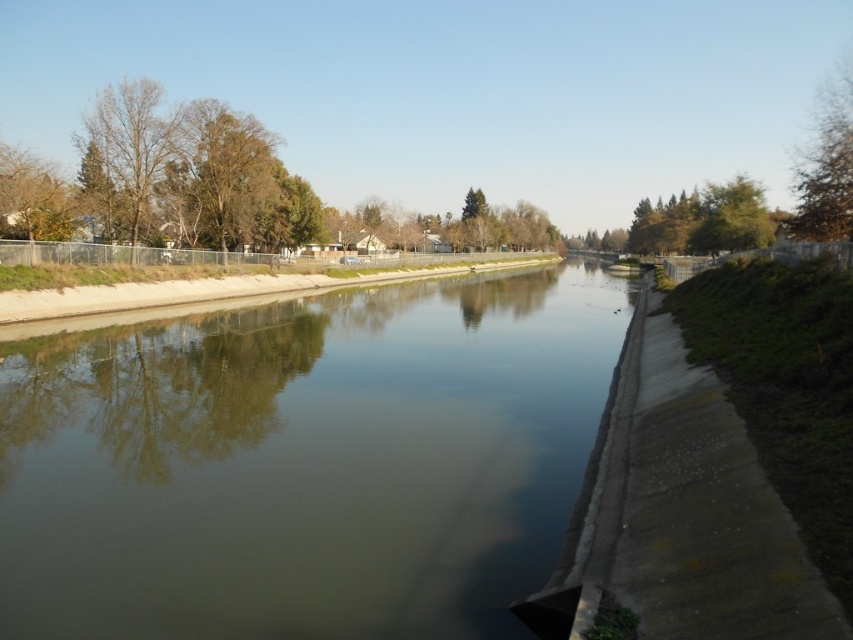
In the scene shown: Is bare branches at left closer to camera compared to green leafy tree at upper right?

No, bare branches at left is further to the viewer.

Does bare branches at left have a greater height compared to green leafy tree at upper right?

No, bare branches at left is not taller than green leafy tree at upper right.

Is point (137, 90) positioned after point (830, 216)?

Yes, it is behind point (830, 216).

At what (x,y) coordinates should I click in order to perform the action: click on bare branches at left. Please return your answer as a coordinate pair (x, y). The height and width of the screenshot is (640, 853). Looking at the image, I should click on click(132, 140).

Which is behind, point (15, 524) or point (166, 150)?

The point (166, 150) is more distant.

Can you confirm if green concrete river at center is positioned to the left of bare branches at left?

No, green concrete river at center is not to the left of bare branches at left.

Does point (38, 534) come in front of point (119, 147)?

Yes, point (38, 534) is in front of point (119, 147).

Image resolution: width=853 pixels, height=640 pixels. What are the coordinates of `green concrete river at center` in the screenshot? It's located at (305, 461).

The width and height of the screenshot is (853, 640). What do you see at coordinates (305, 461) in the screenshot? I see `green concrete river at center` at bounding box center [305, 461].

Consider the image. Who is higher up, green concrete river at center or green leafy tree at upper right?

green leafy tree at upper right

Does point (128, 618) lie behind point (840, 74)?

No.

The image size is (853, 640). I want to click on green concrete river at center, so click(305, 461).